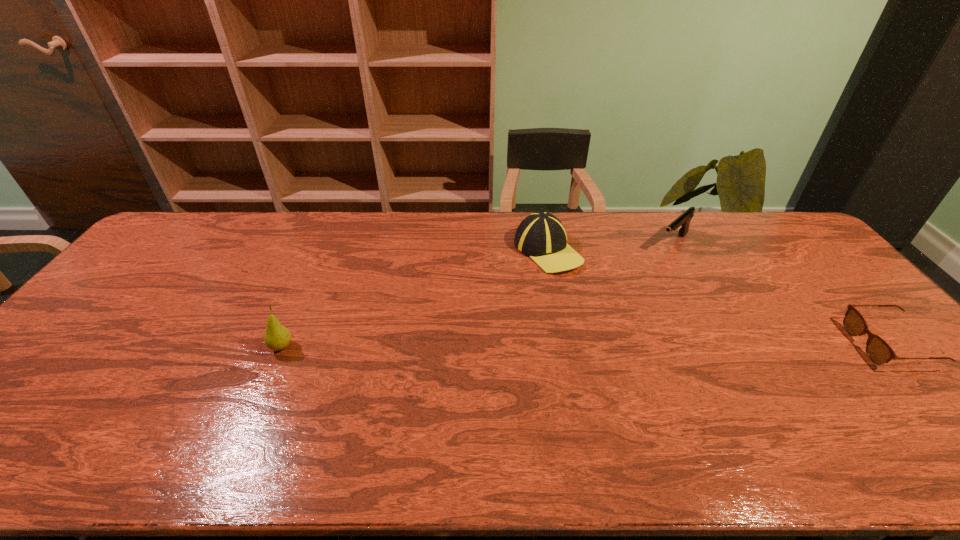
Where is `vacant space that's between the rightmost object and the third object from left to right`? This screenshot has width=960, height=540. vacant space that's between the rightmost object and the third object from left to right is located at coordinates (780, 294).

This screenshot has height=540, width=960. Find the location of `free space between the baseball cap and the second object from right to left`. free space between the baseball cap and the second object from right to left is located at coordinates tap(611, 247).

Where is `free space between the tallest object and the pistol`? This screenshot has width=960, height=540. free space between the tallest object and the pistol is located at coordinates (477, 295).

The height and width of the screenshot is (540, 960). Find the location of `free space between the baseball cap and the shortest object`. free space between the baseball cap and the shortest object is located at coordinates (718, 298).

Locate an element on the screen. Image resolution: width=960 pixels, height=540 pixels. free point between the leftmost object and the baseball cap is located at coordinates (415, 299).

Point out which object is positioned as the second nearest to the third object from left to right. Please provide its 2D coordinates. Your answer should be formatted as a tuple, i.e. [(x, y)], where the tuple contains the x and y coordinates of a point satisfying the conditions above.

[(878, 351)]

Locate an element on the screen. Image resolution: width=960 pixels, height=540 pixels. object that can be found as the second closest to the third object from right to left is located at coordinates (277, 337).

Identify the location of vacant point that satisfies the following two spatial constraints: 1. on the front side of the third object from left to right; 2. at the front view of the spectacles. (729, 345).

The image size is (960, 540). What are the coordinates of `free space that satisfies the following two spatial constraints: 1. on the back side of the second object from right to left; 2. on the right side of the tallest object` in the screenshot? It's located at (327, 243).